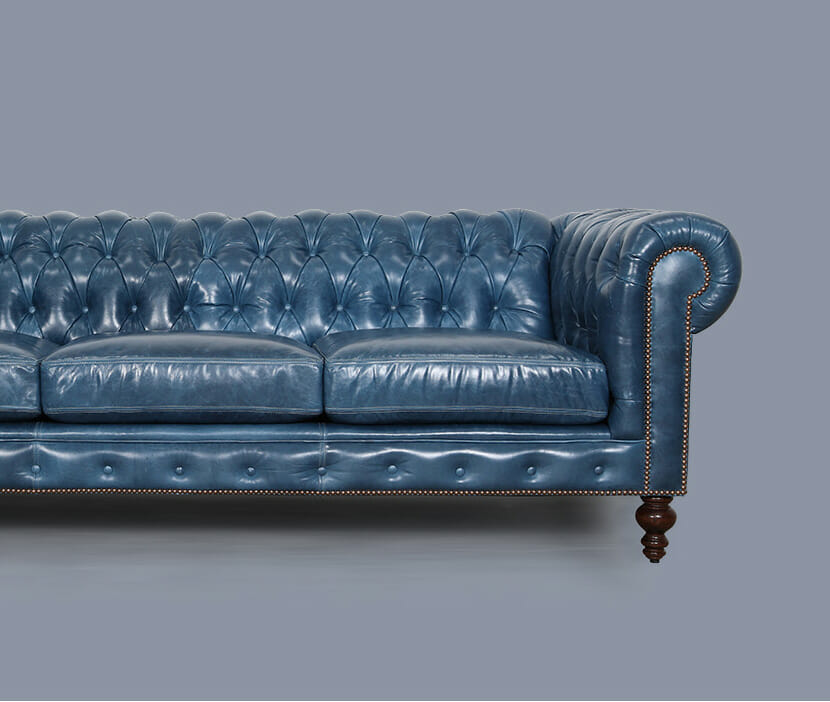
Locate an element on the screen. The width and height of the screenshot is (830, 702). arm of couch is located at coordinates (723, 291).